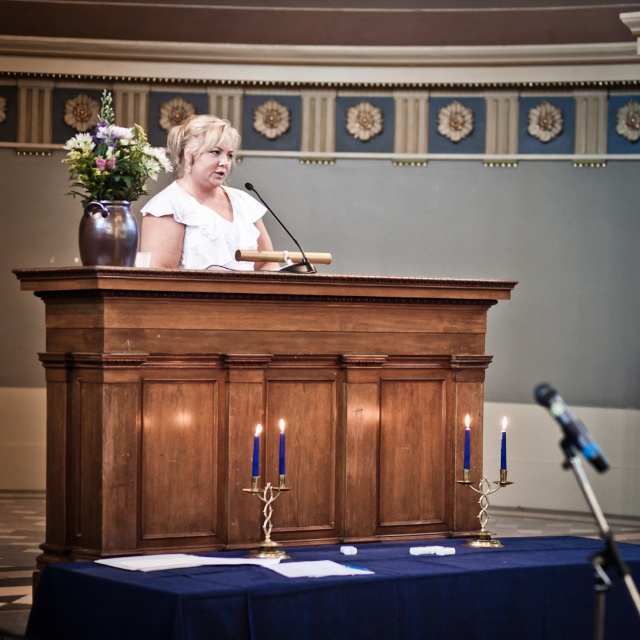
Does white matte dress at center have a lesser height compared to black metallic microphone at lower right?

In fact, white matte dress at center may be taller than black metallic microphone at lower right.

Between point (145, 225) and point (586, 436), which one is positioned behind?

The point (586, 436) is more distant.

Where is `white matte dress at center`? white matte dress at center is located at coordinates (202, 204).

Which is behind, point (193, 330) or point (285, 268)?

Positioned behind is point (285, 268).

Is point (152, 358) farther from camera compared to point (268, 209)?

No, it is not.

Does point (198, 401) come behind point (304, 264)?

No.

What are the coordinates of `wooden table at center` in the screenshot? It's located at (257, 404).

Which is in front, point (301, 355) or point (573, 436)?

Point (301, 355) is in front.

Is point (392, 301) positioned in front of point (541, 388)?

Yes, it is.

Measure the distance between point (x=316, y=531) and camera.

Point (x=316, y=531) and camera are 6.18 meters apart.

Find the location of a particular element. This screenshot has height=640, width=640. wooden table at center is located at coordinates (257, 404).